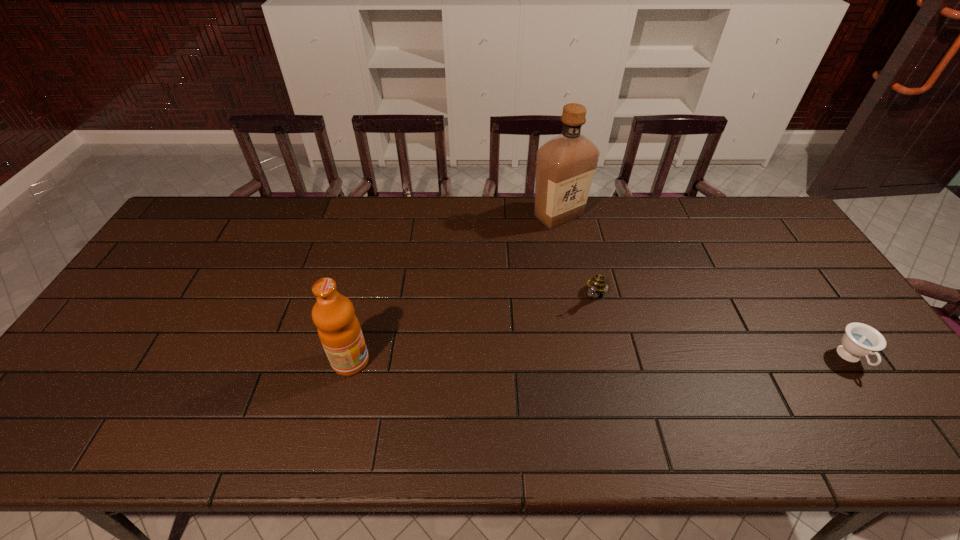
Locate an element on the screen. This screenshot has height=540, width=960. free space between the leftmost object and the snail is located at coordinates (472, 329).

At what (x,y) coordinates should I click in order to perform the action: click on vacant region between the snail and the rightmost object. Please return your answer as a coordinate pair (x, y). The width and height of the screenshot is (960, 540). Looking at the image, I should click on (723, 327).

Identify the location of vacant space in between the liquor and the shortest object. (705, 287).

The image size is (960, 540). I want to click on blank region between the snail and the teacup, so click(723, 327).

Where is `object that ranks as the third closest to the rightmost object`? This screenshot has width=960, height=540. object that ranks as the third closest to the rightmost object is located at coordinates (339, 330).

Locate which object is the second closest to the snail. Please provide its 2D coordinates. Your answer should be formatted as a tuple, i.e. [(x, y)], where the tuple contains the x and y coordinates of a point satisfying the conditions above.

[(860, 340)]

I want to click on vacant space that satisfies the following two spatial constraints: 1. on the front side of the third nearest object; 2. on the left side of the liquor, so click(574, 296).